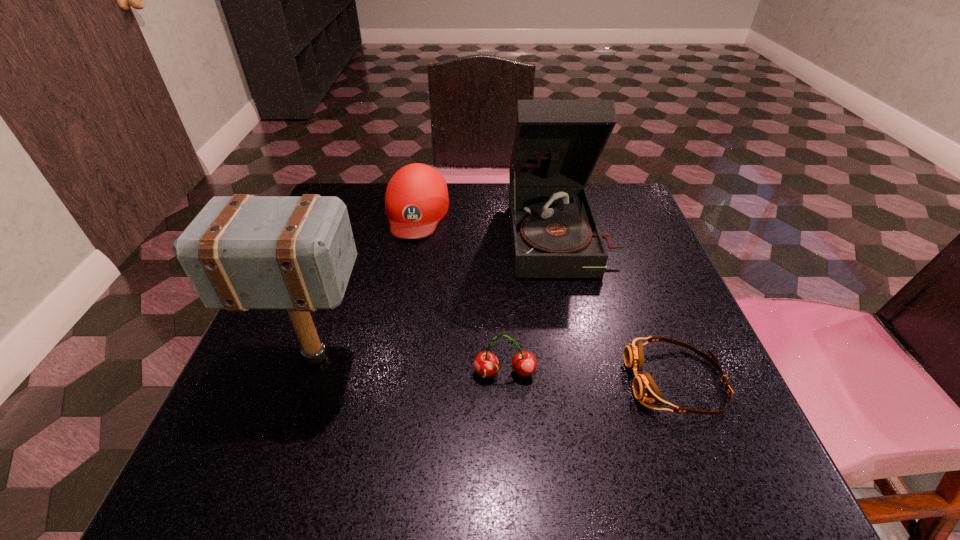
At what (x,y) coordinates should I click in order to perform the action: click on phonograph_record. Please return your answer as a coordinate pair (x, y). The height and width of the screenshot is (540, 960). Looking at the image, I should click on (556, 144).

The width and height of the screenshot is (960, 540). I want to click on mallet, so click(243, 252).

The width and height of the screenshot is (960, 540). Identify the location of baseball cap. (416, 199).

Where is `cherry`? The height and width of the screenshot is (540, 960). cherry is located at coordinates (524, 363).

This screenshot has width=960, height=540. In order to click on goggles in this screenshot , I will do `click(644, 387)`.

Where is `free space located on the front-facing side of the phonograph_record`? free space located on the front-facing side of the phonograph_record is located at coordinates (596, 387).

Find the location of `free location located 0.310m on the striking surface of the mallet`. free location located 0.310m on the striking surface of the mallet is located at coordinates (546, 357).

I want to click on vacant area situated on the front-facing side of the baseball cap, so click(396, 315).

The height and width of the screenshot is (540, 960). What are the coordinates of `vacant region located with stems pointing upwards on the cherry` in the screenshot? It's located at (508, 434).

In order to click on free spot located 0.300m with the lenses facing forward on the shortest object in this screenshot , I will do `click(449, 381)`.